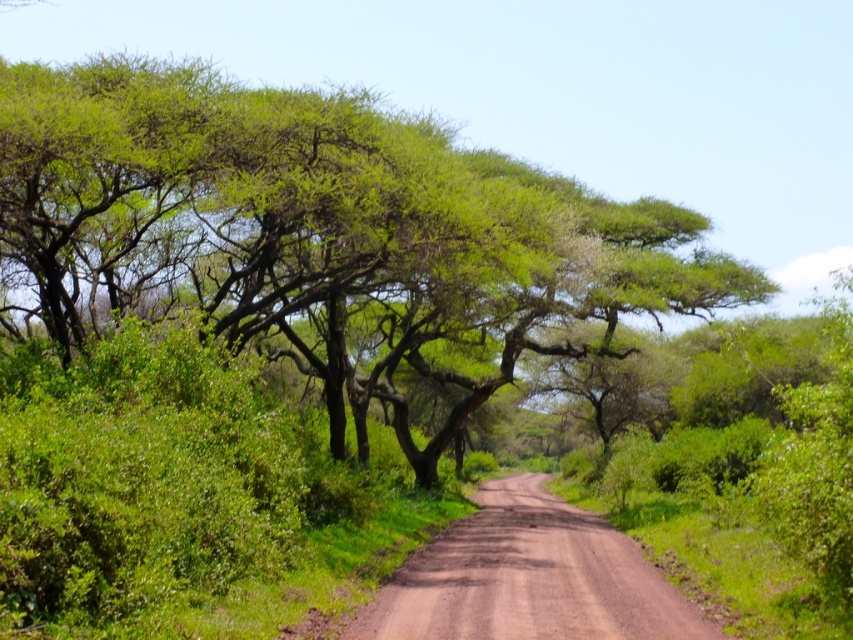
Question: Is green leafy tree at center positioned before brown dusty road at center?

Choices:
 (A) yes
 (B) no

Answer: (B)

Question: Which object is farther from the camera taking this photo?

Choices:
 (A) green leafy tree at center
 (B) brown dusty road at center

Answer: (A)

Question: Among these objects, which one is farthest from the camera?

Choices:
 (A) brown dusty road at center
 (B) green leafy tree at center

Answer: (B)

Question: Considering the relative positions of green leafy tree at center and brown dusty road at center in the image provided, where is green leafy tree at center located with respect to brown dusty road at center?

Choices:
 (A) above
 (B) below

Answer: (A)

Question: From the image, what is the correct spatial relationship of green leafy tree at center in relation to brown dusty road at center?

Choices:
 (A) above
 (B) below

Answer: (A)

Question: Which of the following is the farthest from the observer?

Choices:
 (A) green leafy tree at center
 (B) brown dusty road at center

Answer: (A)